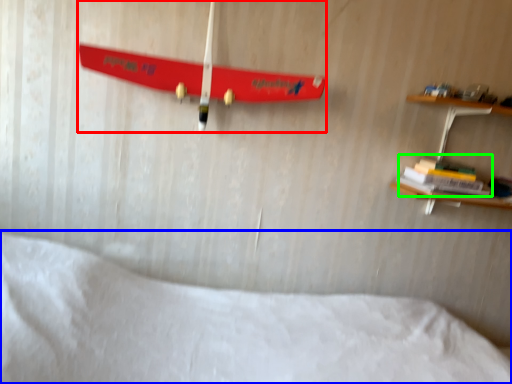
Question: Which object is the closest to the skateboard (highlighted by a red box)? Choose among these: bed (highlighted by a blue box) or book (highlighted by a green box).

Choices:
 (A) bed
 (B) book

Answer: (A)